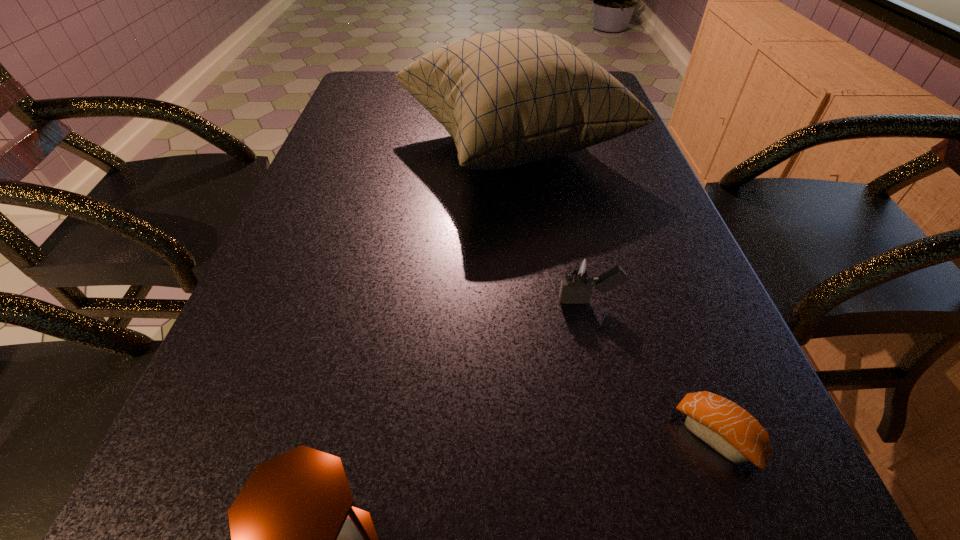
At what (x,y) coordinates should I click in order to perform the action: click on free space between the tallest object and the second shortest object. Please return your answer as a coordinate pair (x, y). Looking at the image, I should click on (551, 223).

At what (x,y) coordinates should I click in order to perform the action: click on free area in between the tallest object and the igniter. Please return your answer as a coordinate pair (x, y). This screenshot has height=540, width=960. Looking at the image, I should click on (551, 223).

Identify the location of vacant space in between the tallest object and the third farthest object. This screenshot has height=540, width=960. (614, 291).

Choose which object is the nearest neighbor to the farthest object. Please provide its 2D coordinates. Your answer should be formatted as a tuple, i.e. [(x, y)], where the tuple contains the x and y coordinates of a point satisfying the conditions above.

[(579, 278)]

Select which object appears as the closest to the hourglass. Please provide its 2D coordinates. Your answer should be formatted as a tuple, i.e. [(x, y)], where the tuple contains the x and y coordinates of a point satisfying the conditions above.

[(726, 427)]

Where is `vacant space that satisfies the following two spatial constraints: 1. on the front side of the farthest object; 2. on the left side of the third farthest object`? vacant space that satisfies the following two spatial constraints: 1. on the front side of the farthest object; 2. on the left side of the third farthest object is located at coordinates (541, 437).